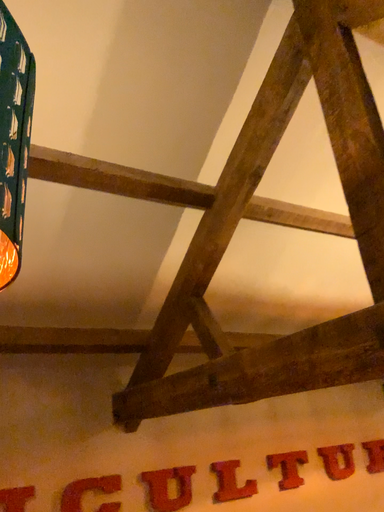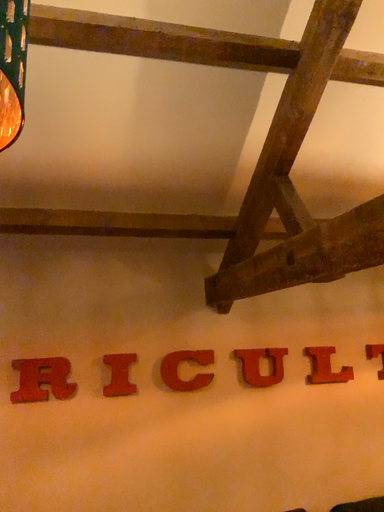
Question: How did the camera likely rotate when shooting the video?

Choices:
 (A) rotated left
 (B) rotated right

Answer: (A)